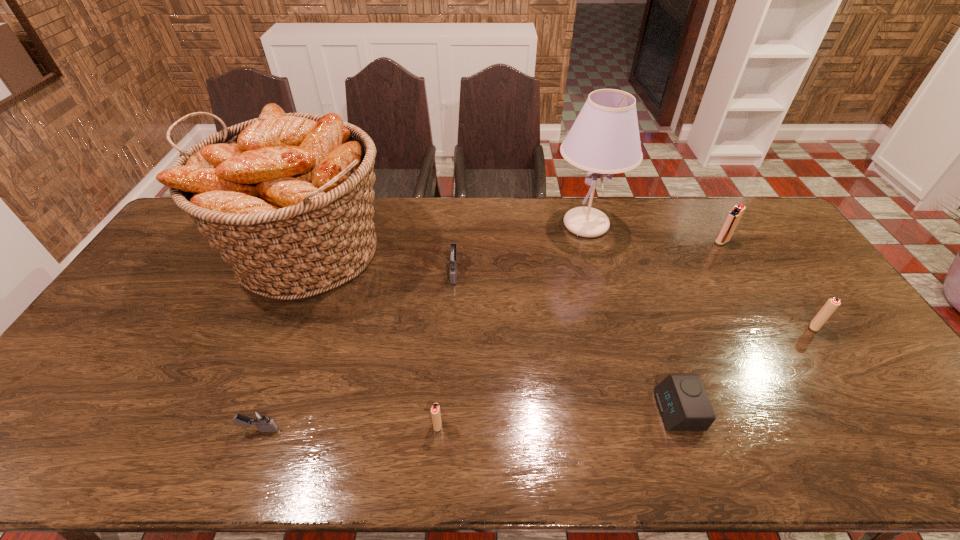
The image size is (960, 540). In order to click on vacant space that's between the nearest red igniter and the rightmost igniter in this screenshot , I will do tap(626, 376).

Locate an element on the screen. vacant space in between the left gray igniter and the biggest red igniter is located at coordinates pos(491,335).

The height and width of the screenshot is (540, 960). I want to click on vacant area that lies between the biggest red igniter and the basket, so click(x=513, y=247).

At what (x,y) coordinates should I click in order to perform the action: click on free space between the lampshade and the fourth nearest igniter. Please return your answer as a coordinate pair (x, y). The image size is (960, 540). Looking at the image, I should click on (x=520, y=248).

This screenshot has height=540, width=960. In order to click on blank region between the basket and the smaller gray igniter in this screenshot , I will do `click(282, 341)`.

Find the location of a particular element. This screenshot has width=960, height=540. object that is the seventh nearest to the shortest object is located at coordinates tap(259, 417).

Identify which object is the fourth closest to the shortest object. Please provide its 2D coordinates. Your answer should be formatted as a tuple, i.e. [(x, y)], where the tuple contains the x and y coordinates of a point satisfying the conditions above.

[(452, 257)]

Locate an element on the screen. igniter that stands as the closest to the leftmost red igniter is located at coordinates (259, 417).

The image size is (960, 540). What are the coordinates of `igniter object that ranks as the third closest to the rightmost red igniter` in the screenshot? It's located at (435, 410).

Identify which red igniter is the second nearest to the rightmost object. Please provide its 2D coordinates. Your answer should be formatted as a tuple, i.e. [(x, y)], where the tuple contains the x and y coordinates of a point satisfying the conditions above.

[(435, 410)]